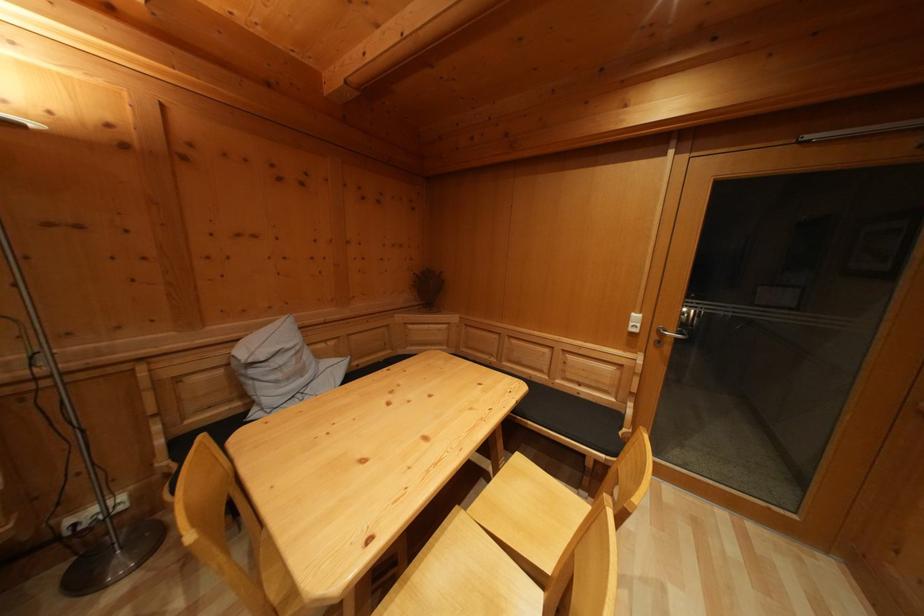
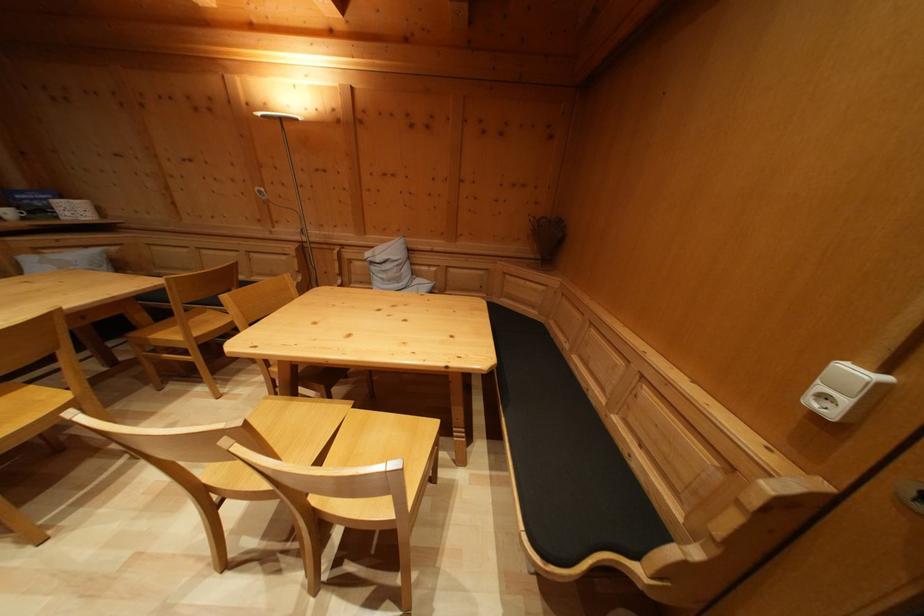
In the second image, find the point that corresponds to the point at 642,323 in the first image.

(859, 379)